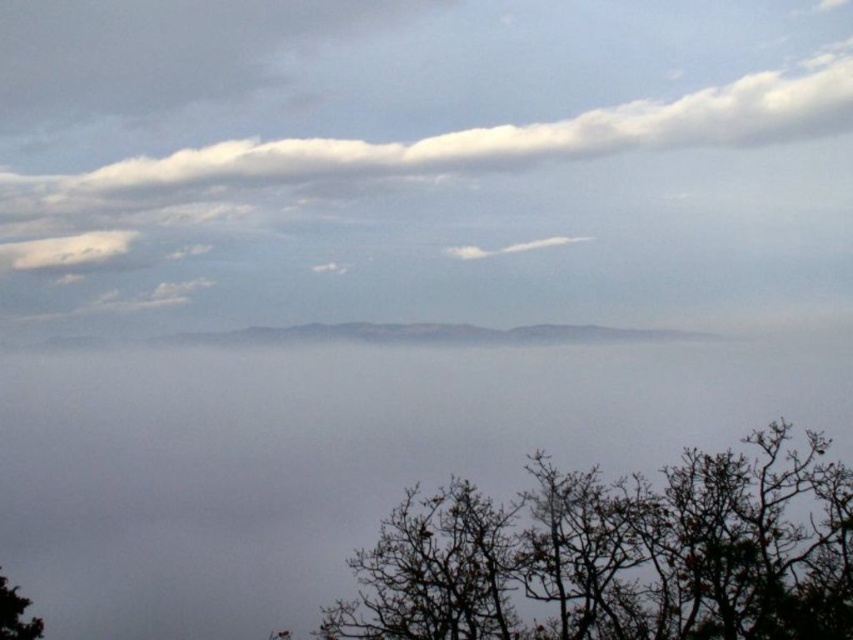
Question: Which of these objects is positioned closest to the white fluffy cloud at center?

Choices:
 (A) brown leafless branches at lower right
 (B) white fluffy cloud at upper center
 (C) green matte tree at lower left

Answer: (B)

Question: Can you confirm if brown leafless branches at lower right is thinner than green matte tree at lower left?

Choices:
 (A) no
 (B) yes

Answer: (A)

Question: In this image, where is white fluffy cloud at upper center located relative to green matte tree at lower left?

Choices:
 (A) left
 (B) right

Answer: (B)

Question: Considering the real-world distances, which object is farthest from the white fluffy cloud at upper center?

Choices:
 (A) green matte tree at lower left
 (B) white fluffy cloud at center

Answer: (A)

Question: Which point is farther to the camera?

Choices:
 (A) coord(7,632)
 (B) coord(738,92)

Answer: (B)

Question: Does white fluffy cloud at upper center appear on the left side of green matte tree at lower left?

Choices:
 (A) no
 (B) yes

Answer: (A)